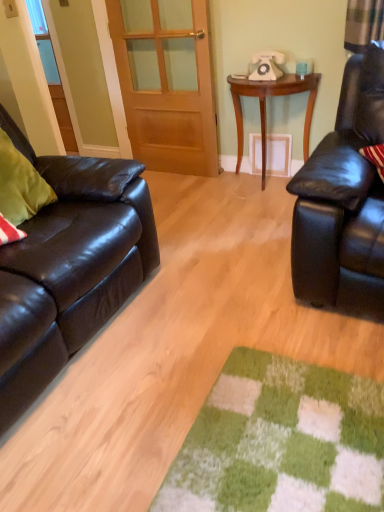
At what (x,y) coordinates should I click in order to perform the action: click on vacant space situated on the left part of wooden table at center. Please return your answer as a coordinate pair (x, y). This screenshot has height=512, width=384. Looking at the image, I should click on (206, 195).